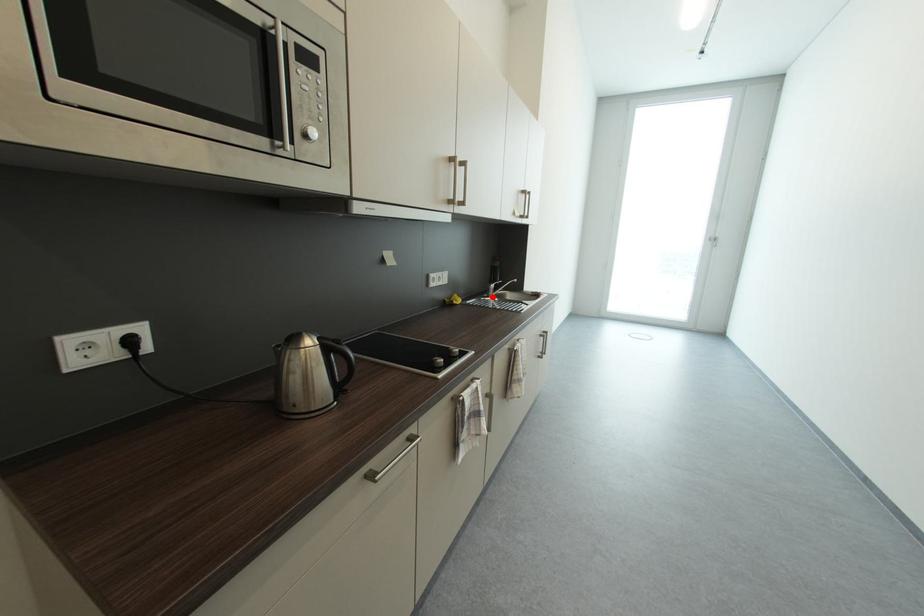
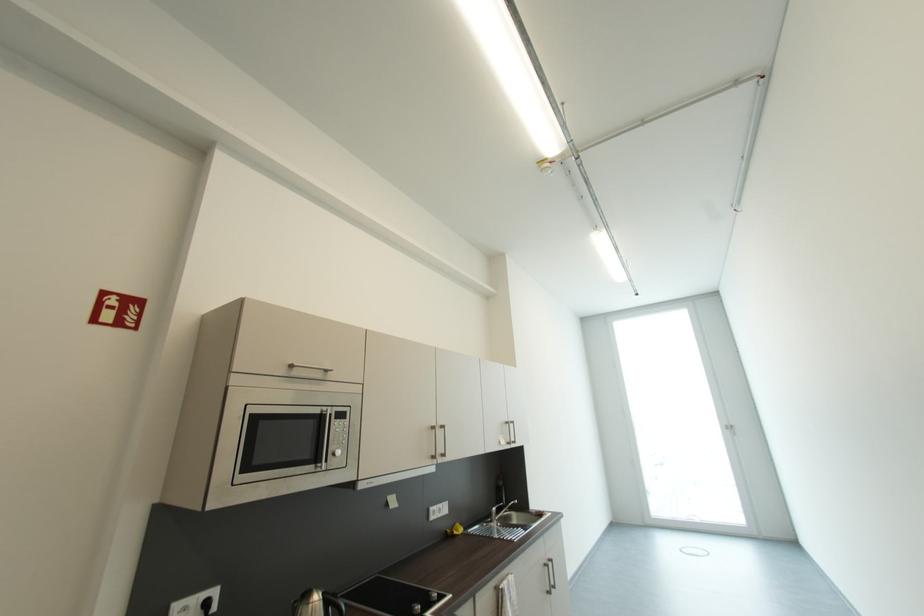
Question: I am providing you with two images of the same scene from different viewpoints. Image1 has a red point marked. In image2, the corresponding 3D location appears at what relative position? Reply with the corresponding letter.

Choices:
 (A) Closer
 (B) Farther

Answer: (B)